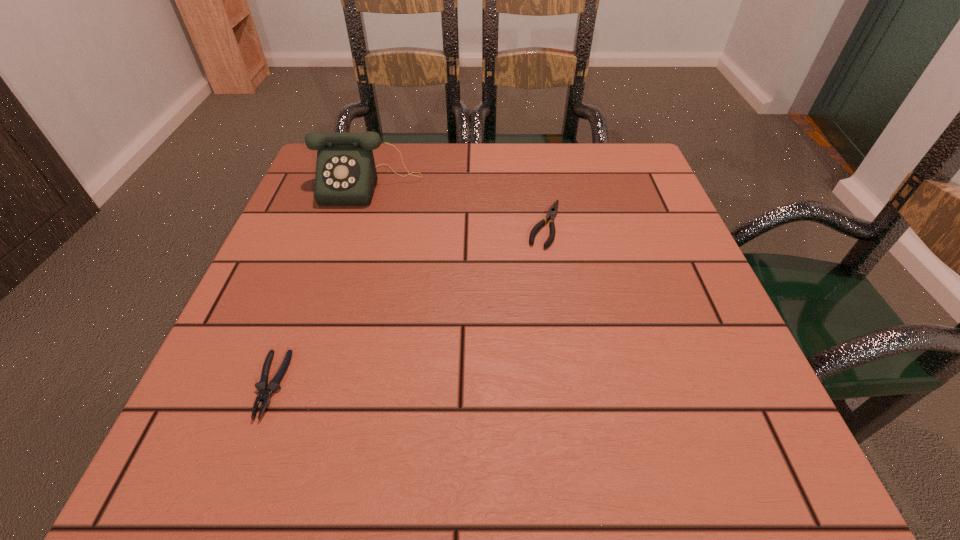
The image size is (960, 540). What are the coordinates of `vacant space at the far right corner of the desktop` in the screenshot? It's located at (629, 173).

Find the location of a particular element. The width and height of the screenshot is (960, 540). unoccupied position between the nearest object and the tallest object is located at coordinates (320, 285).

This screenshot has width=960, height=540. In order to click on free space between the nearer pliers and the rightmost object in this screenshot , I will do `click(408, 305)`.

Identify the location of empty location between the tallest object and the nearest object. (320, 285).

The image size is (960, 540). In order to click on free point between the nearer pliers and the tallest object in this screenshot , I will do `click(320, 285)`.

Locate an element on the screen. free space between the left pliers and the rightmost object is located at coordinates (408, 305).

Image resolution: width=960 pixels, height=540 pixels. In order to click on free point between the nearest object and the telephone in this screenshot , I will do `click(320, 285)`.

The image size is (960, 540). What are the coordinates of `vacant space that is in between the nearest object and the telephone` in the screenshot? It's located at (320, 285).

Find the location of a particular element. Image resolution: width=960 pixels, height=540 pixels. vacant area that lies between the rightmost object and the nearest object is located at coordinates (x=408, y=305).

Locate an element on the screen. The width and height of the screenshot is (960, 540). vacant point located between the tallest object and the nearest object is located at coordinates (320, 285).